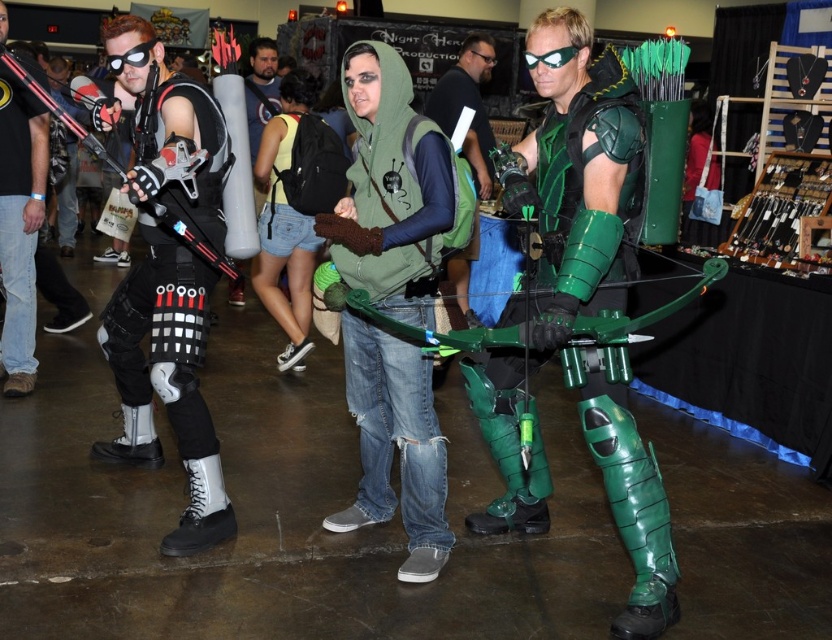
Question: Which point appears farthest from the camera in this image?

Choices:
 (A) (141, 291)
 (B) (409, 416)
 (C) (650, 628)

Answer: (A)

Question: Among these points, which one is farthest from the camera?

Choices:
 (A) (360, 420)
 (B) (204, 534)

Answer: (A)

Question: Does green matte armor at center appear on the right side of green knitted vest at center?

Choices:
 (A) yes
 (B) no

Answer: (A)

Question: Does green knitted vest at center have a smaller size compared to black leather boots at left?

Choices:
 (A) no
 (B) yes

Answer: (B)

Question: Is the position of green matte armor at center more distant than that of black leather boots at left?

Choices:
 (A) no
 (B) yes

Answer: (A)

Question: Which object is positioned closest to the black leather boots at left?

Choices:
 (A) green matte armor at center
 (B) green knitted vest at center

Answer: (B)